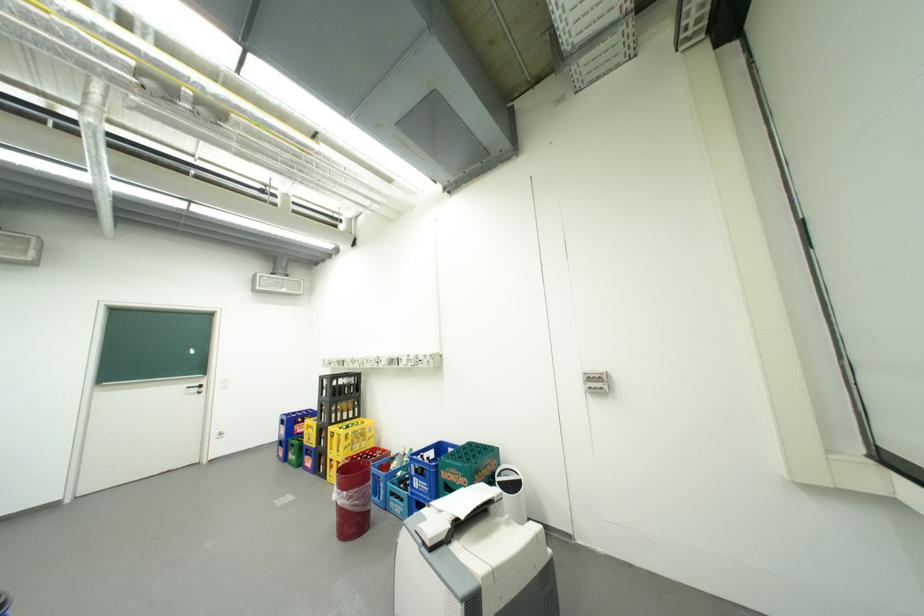
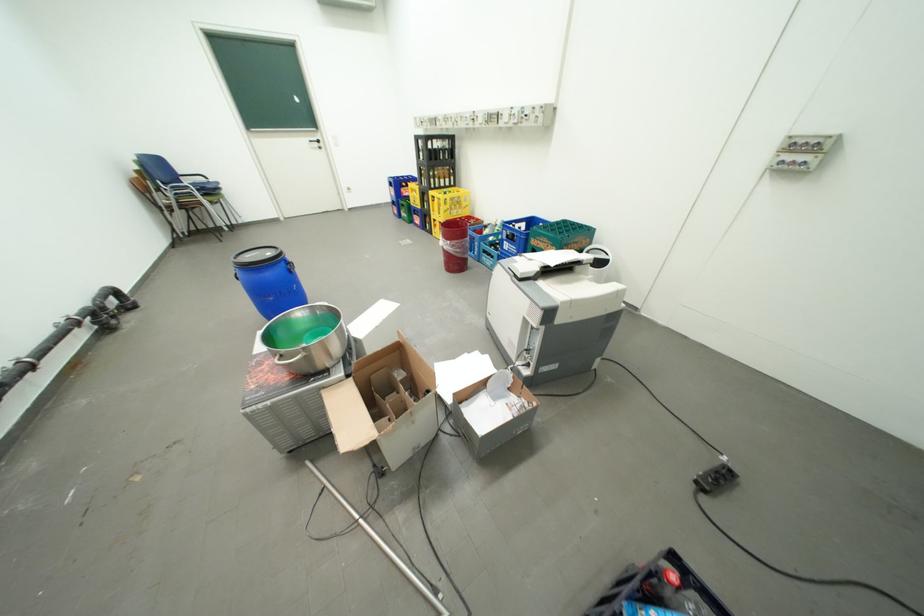
The images are taken continuously from a first-person perspective. In which direction is your viewpoint rotating?

The rotation direction of the camera is left-down.